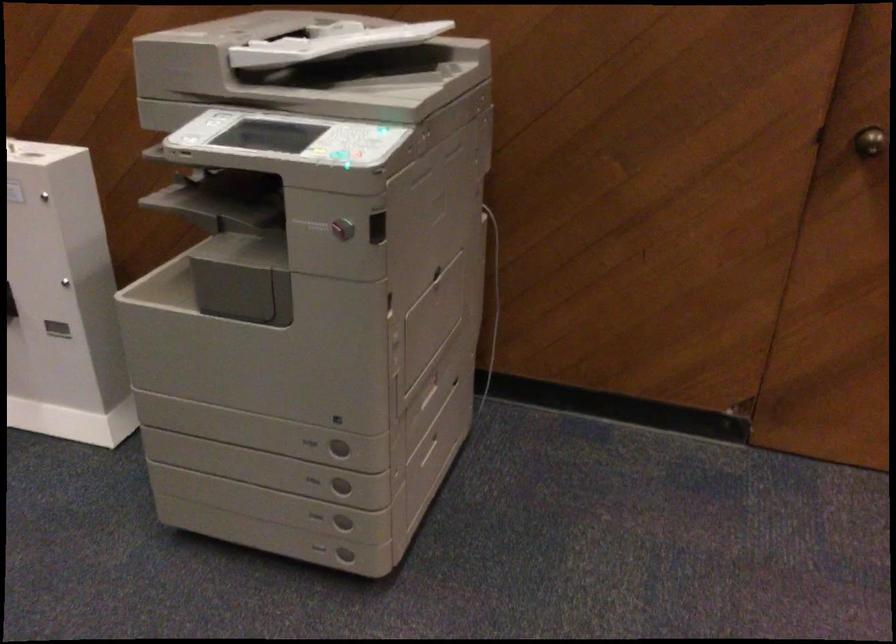
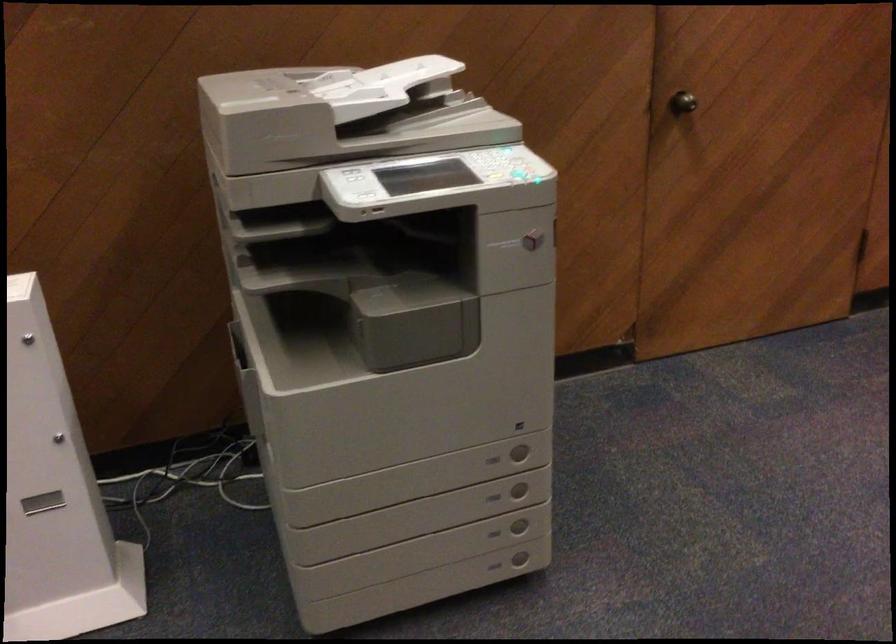
In the second image, find the point that corresponds to (x=314, y=552) in the first image.

(494, 567)